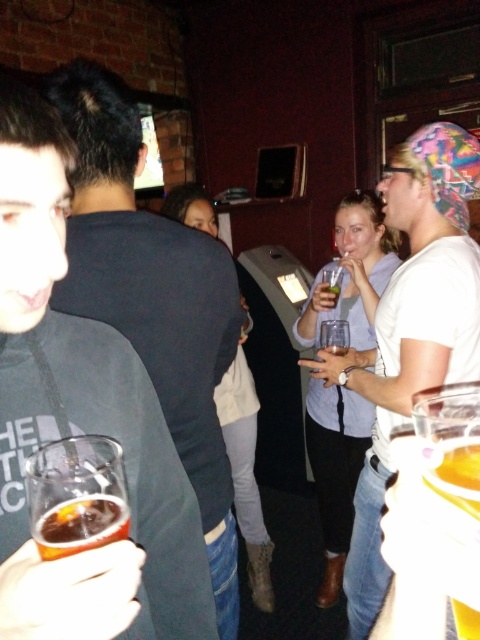
You are a bartender at the bar. You need to place a new drink order on the counter next to the light blue denim jeans at center and the translucent amber liquid at lower left. Which object should you place the drink closer to if you want to ensure it doesn

The translucent amber liquid at lower left is narrower than the light blue denim jeans at center. Therefore, placing the drink closer to the translucent amber liquid at lower left would provide more space.

You are a bartender who needs to deliver a drink to a customer wearing light blue denim jeans at center. The clear plastic glass at left contains the drink. Can you reach the customer without moving the glass more than 5 feet?

The clear plastic glass at left is 4.50 feet from light blue denim jeans at center. Since 4.50 feet is less than 5 feet, you can reach the customer without moving the glass more than 5 feet.